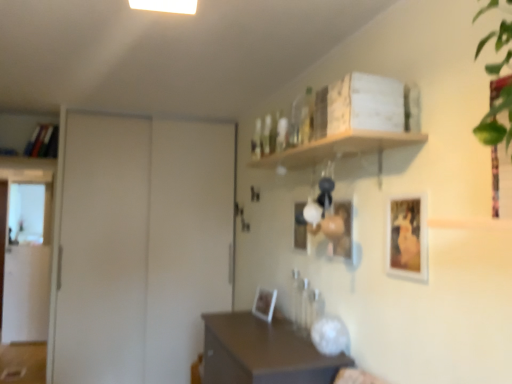
Question: Is translucent glass bottle at upper center facing towards brown matte table at center?

Choices:
 (A) yes
 (B) no

Answer: (B)

Question: Does translucent glass bottle at upper center have a greater height compared to brown matte table at center?

Choices:
 (A) yes
 (B) no

Answer: (B)

Question: Is the position of translucent glass bottle at upper center less distant than that of brown matte table at center?

Choices:
 (A) yes
 (B) no

Answer: (B)

Question: From the image's perspective, is translucent glass bottle at upper center located beneath brown matte table at center?

Choices:
 (A) no
 (B) yes

Answer: (A)

Question: Can you confirm if translucent glass bottle at upper center is bigger than brown matte table at center?

Choices:
 (A) no
 (B) yes

Answer: (A)

Question: From a real-world perspective, does translucent glass bottle at upper center stand above brown matte table at center?

Choices:
 (A) no
 (B) yes

Answer: (B)

Question: Considering the relative positions of matte white picture frame at center, the 1th picture frame from the back, and matte black picture frame at center, acting as the 3th picture frame starting from the front, in the image provided, is matte white picture frame at center, the 1th picture frame from the back, to the right of matte black picture frame at center, acting as the 3th picture frame starting from the front, from the viewer's perspective?

Choices:
 (A) no
 (B) yes

Answer: (A)

Question: Is matte white picture frame at center, which ranks as the fourth picture frame in front-to-back order, not inside matte black picture frame at center, acting as the 3th picture frame starting from the front?

Choices:
 (A) yes
 (B) no

Answer: (A)

Question: Is matte white picture frame at center, the 4th picture frame from the right, taller than matte black picture frame at center, arranged as the second picture frame when viewed from the back?

Choices:
 (A) no
 (B) yes

Answer: (A)

Question: Can you confirm if matte white picture frame at center, which ranks as the fourth picture frame in front-to-back order, is shorter than matte black picture frame at center, acting as the 3th picture frame starting from the front?

Choices:
 (A) yes
 (B) no

Answer: (A)

Question: Does matte white picture frame at center, which ranks as the fourth picture frame in front-to-back order, lie in front of matte black picture frame at center, marked as the 2th picture frame in a left-to-right arrangement?

Choices:
 (A) no
 (B) yes

Answer: (A)

Question: From a real-world perspective, is matte white picture frame at center, the 4th picture frame from the right, under matte black picture frame at center, placed as the third picture frame when sorted from right to left?

Choices:
 (A) no
 (B) yes

Answer: (B)

Question: Could you tell me if white matte door at left is turned towards matte wooden picture frame at center, which appears as the second picture frame when viewed from the right?

Choices:
 (A) no
 (B) yes

Answer: (B)